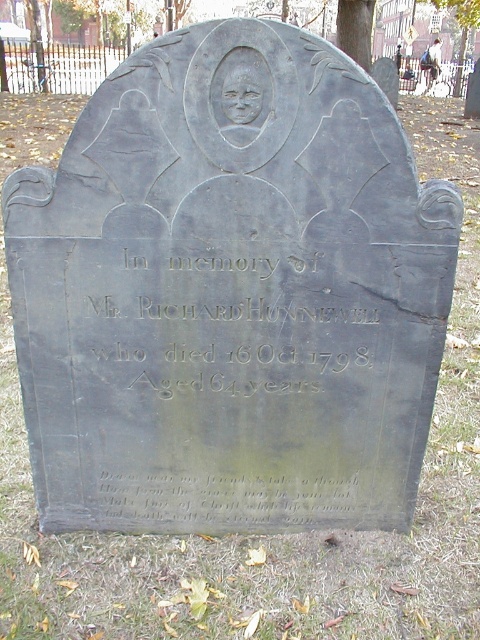
You are standing in front of the gravestone and want to read both the black stone plaque at center and the black stone inscription at lower center. Which one do you need to look up at or down at to view?

The black stone plaque at center is closer to the viewer than the black stone inscription at lower center, so you would look down at the black stone inscription at lower center and look up at the black stone plaque at center to view them both.

You are standing in front of a gravestone in a cemetery. You see a black stone plaque at center and a black stone inscription at lower center. Which one is located higher up on the gravestone?

The black stone plaque at center is positioned over the black stone inscription at lower center, so it is located higher up on the gravestone.